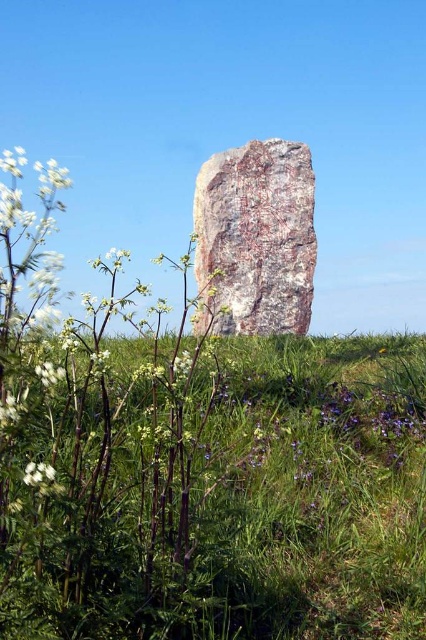
Image resolution: width=426 pixels, height=640 pixels. What do you see at coordinates (241, 506) in the screenshot?
I see `green grass at center` at bounding box center [241, 506].

Find the location of `green grass at center`. green grass at center is located at coordinates (241, 506).